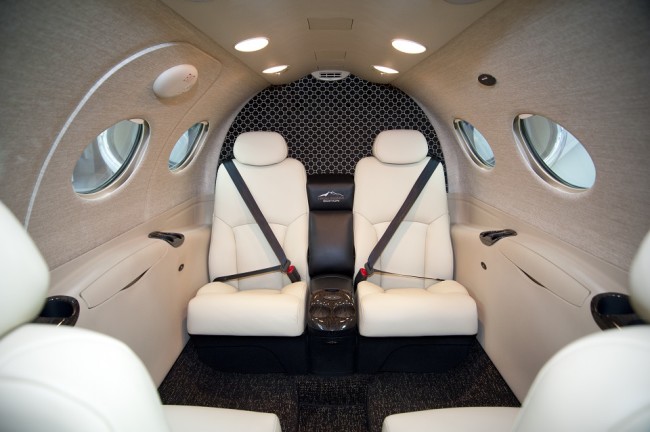
Where is `lights`? The height and width of the screenshot is (432, 650). lights is located at coordinates (254, 46), (276, 66), (413, 46), (384, 71).